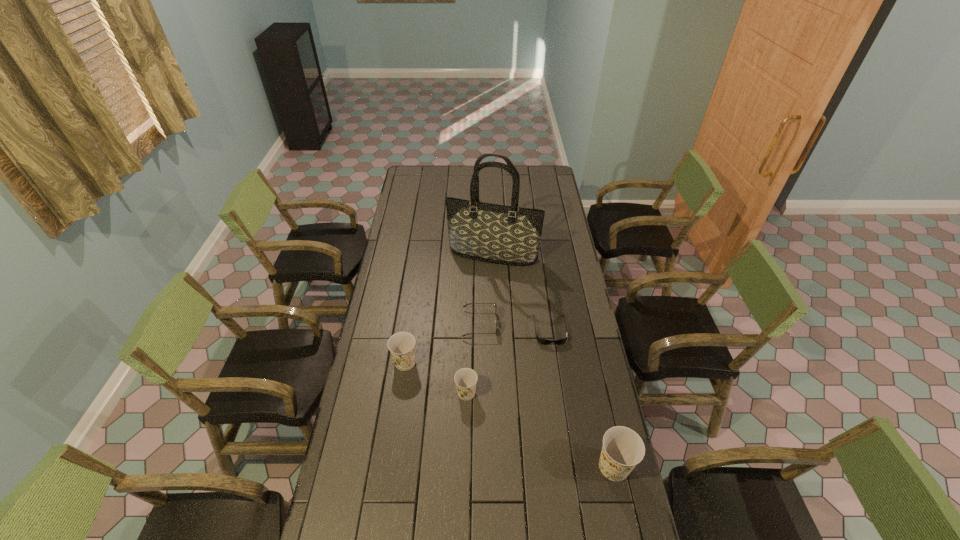
To make them evenly spaced by inserting another Dixie_cup among them, please locate a free space for this new Dixie_cup. Please provide its 2D coordinates. Your answer should be formatted as a tuple, i.e. [(x, y)], where the tuple contains the x and y coordinates of a point satisfying the conditions above.

[(536, 428)]